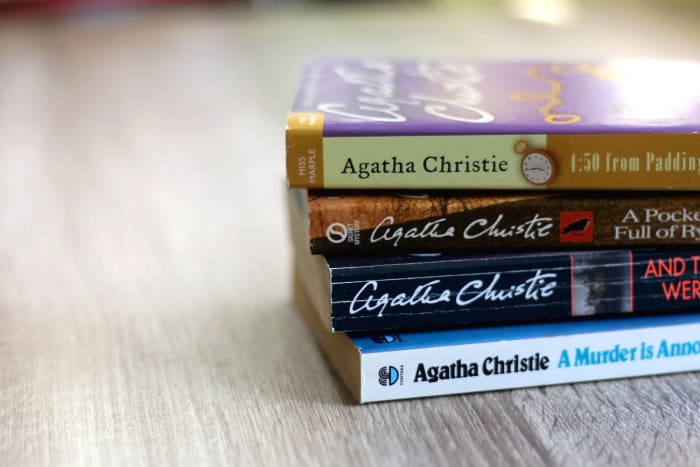
Identify the location of book. pos(491,155), pos(470,226), pos(482,288), pos(486,369).